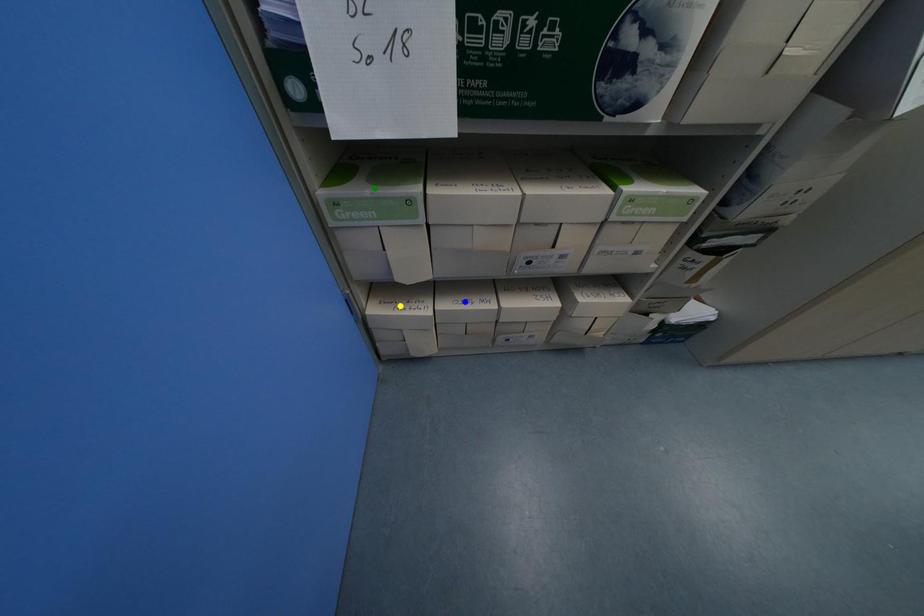
Order these from nearest to farthest:
1. blue point
2. yellow point
3. green point

green point < yellow point < blue point